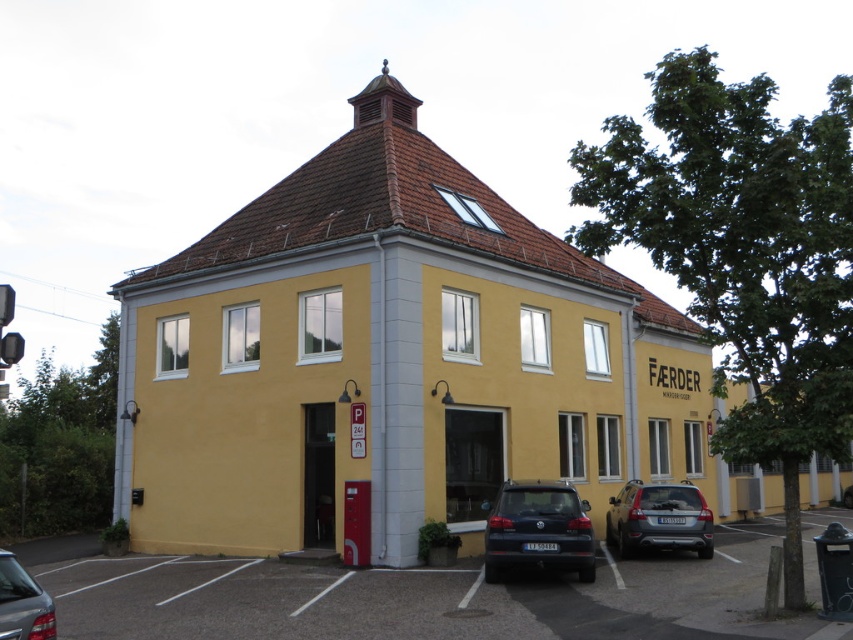
Question: Which point appears closest to the camera in this image?

Choices:
 (A) (30, 604)
 (B) (612, 518)
 (C) (517, 579)

Answer: (A)

Question: Which of these objects is positioned closest to the shiny silver sedan at lower left?

Choices:
 (A) gray asphalt parking lot at lower center
 (B) satin silver suv at lower right
 (C) matte black car at lower center

Answer: (A)

Question: Does matte black car at lower center lie in front of satin silver suv at lower right?

Choices:
 (A) no
 (B) yes

Answer: (B)

Question: Considering the real-world distances, which object is closest to the shiny silver sedan at lower left?

Choices:
 (A) matte black car at lower center
 (B) satin silver suv at lower right

Answer: (A)

Question: Is gray asphalt parking lot at lower center to the left of shiny silver sedan at lower left from the viewer's perspective?

Choices:
 (A) no
 (B) yes

Answer: (A)

Question: Does gray asphalt parking lot at lower center come in front of satin silver suv at lower right?

Choices:
 (A) yes
 (B) no

Answer: (A)